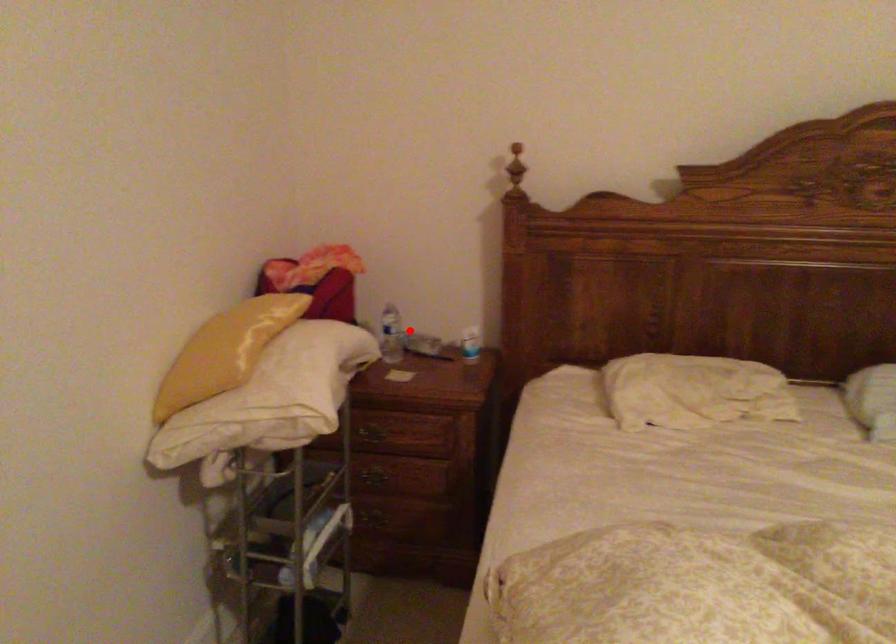
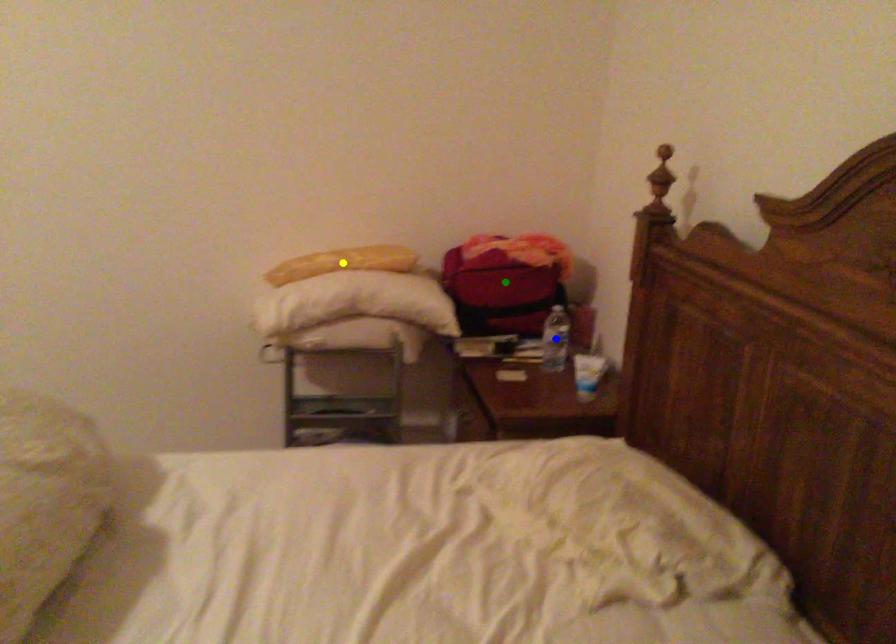
Question: I am providing you with two images of the same scene from different viewpoints. A red point is marked on the first image. You are given multiple points on the second image. Which point in image 2 represents the same 3d spot as the red point in image 1?

Choices:
 (A) green point
 (B) yellow point
 (C) blue point

Answer: (C)